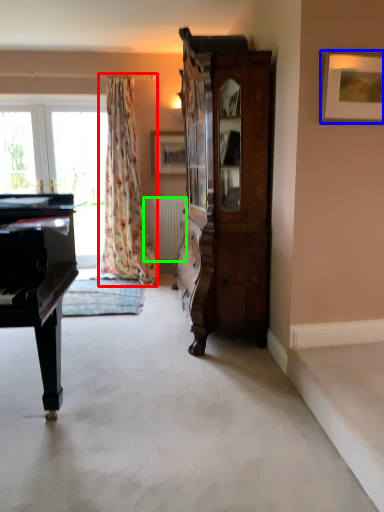
Question: Based on their relative distances, which object is nearer to curtain (highlighted by a red box)? Choose from picture frame (highlighted by a blue box) and radiator (highlighted by a green box).

Choices:
 (A) picture frame
 (B) radiator

Answer: (B)